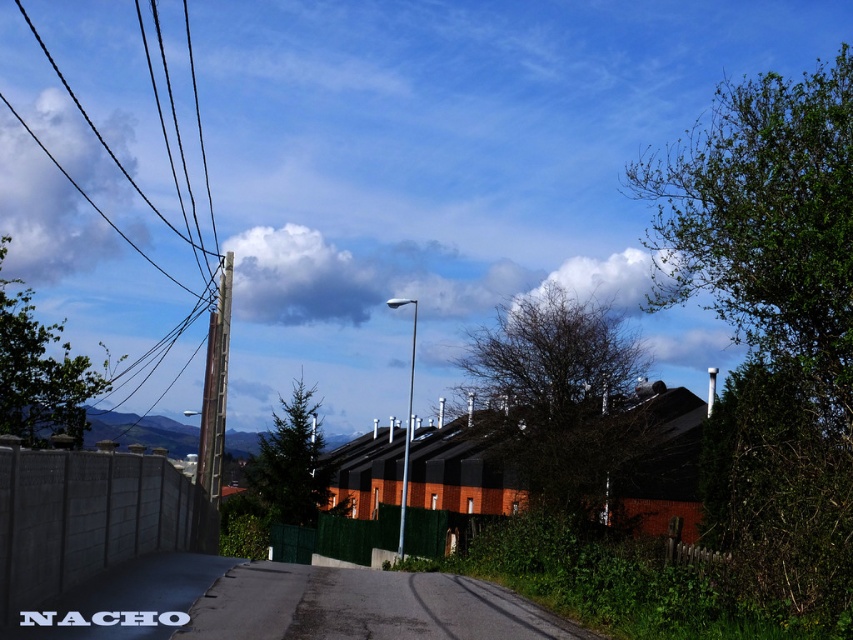
Question: Does asphalt road at center appear over brown wooden pole at left?

Choices:
 (A) no
 (B) yes

Answer: (A)

Question: Based on their relative distances, which object is nearer to the green plastic fence at center?

Choices:
 (A) concrete fence at lower left
 (B) silver metallic pole at center
 (C) asphalt road at center
 (D) brown wooden pole at left

Answer: (B)

Question: Which of these objects is positioned farthest from the silver metallic pole at center?

Choices:
 (A) white fluffy cloud at upper left
 (B) asphalt road at center

Answer: (A)

Question: Can you confirm if asphalt road at center is smaller than concrete fence at lower left?

Choices:
 (A) no
 (B) yes

Answer: (A)

Question: Which point appears closest to the camera in this image?

Choices:
 (A) (24, 458)
 (B) (94, 204)
 (C) (407, 429)

Answer: (A)

Question: Observing the image, what is the correct spatial positioning of asphalt road at center in reference to green plastic fence at center?

Choices:
 (A) above
 (B) below

Answer: (A)